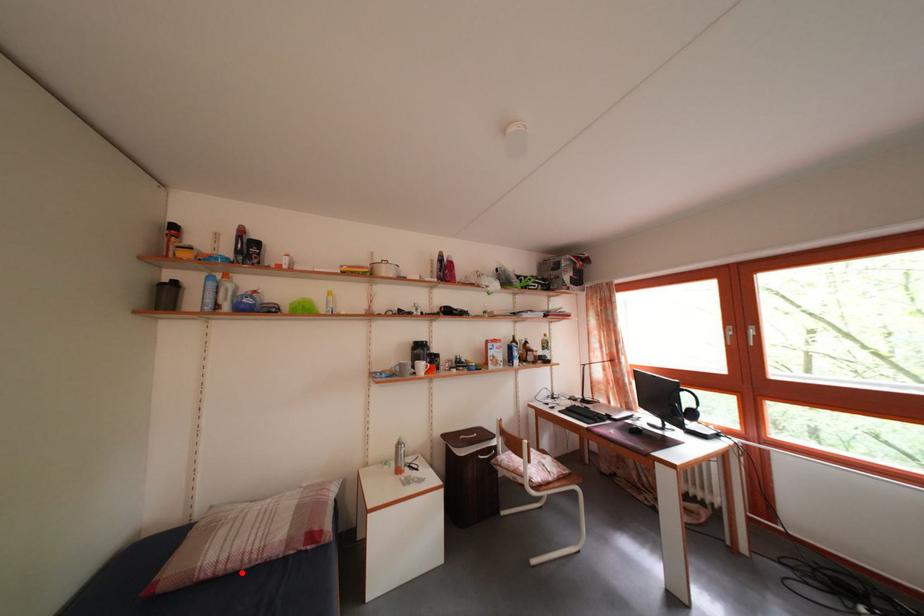
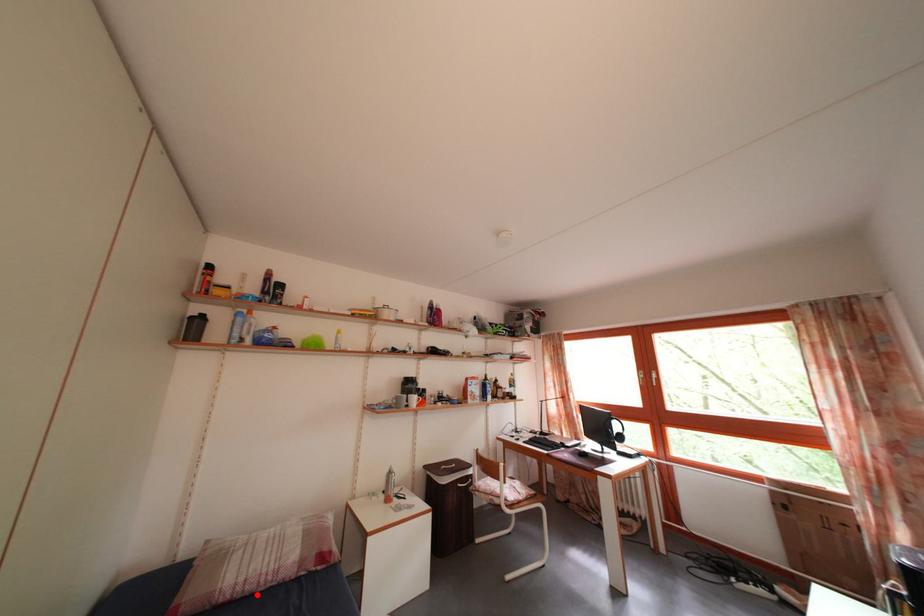
I am providing you with two images of the same scene from different viewpoints. A red point is marked on the first image and another point is marked on the second image. Is the marked point in image1 the same physical position as the marked point in image2?

Yes